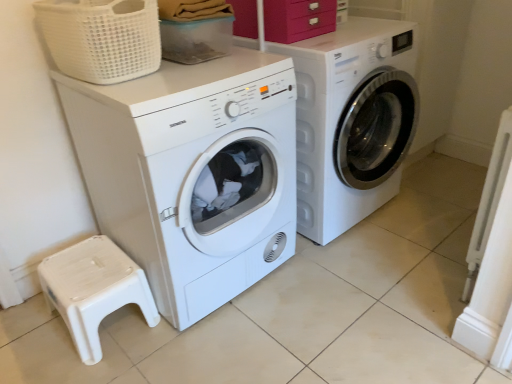
The image size is (512, 384). What do you see at coordinates (101, 38) in the screenshot? I see `white woven basket at upper left` at bounding box center [101, 38].

The height and width of the screenshot is (384, 512). Find the location of `white plastic step stool at lower left`. white plastic step stool at lower left is located at coordinates (93, 290).

Where is `white woven basket at upper left`? The height and width of the screenshot is (384, 512). white woven basket at upper left is located at coordinates (101, 38).

Would you say translucent plastic container at upper center is a long distance from white plastic step stool at lower left?

No, translucent plastic container at upper center is in close proximity to white plastic step stool at lower left.

Considering the relative sizes of translucent plastic container at upper center and white plastic step stool at lower left in the image provided, is translucent plastic container at upper center smaller than white plastic step stool at lower left?

Yes.

Considering the sizes of translucent plastic container at upper center and white plastic step stool at lower left in the image, is translucent plastic container at upper center wider or thinner than white plastic step stool at lower left?

In the image, translucent plastic container at upper center appears to be more narrow than white plastic step stool at lower left.

Visually, is white woven basket at upper left positioned to the left or to the right of white glossy washing machine at center, the first washing machine positioned from the right?

white woven basket at upper left is positioned on white glossy washing machine at center, the first washing machine positioned from the right,'s left side.

From the image's perspective, is white woven basket at upper left under white glossy washing machine at center, marked as the 2th washing machine in a left-to-right arrangement?

No, from the image's perspective, white woven basket at upper left is not below white glossy washing machine at center, marked as the 2th washing machine in a left-to-right arrangement.

What's the angular difference between white woven basket at upper left and white glossy washing machine at center, marked as the 2th washing machine in a left-to-right arrangement,'s facing directions?

2.08 degrees.

In the scene shown: From a real-world perspective, is white woven basket at upper left physically located above or below white glossy washing machine at center, the first washing machine positioned from the right?

white woven basket at upper left is situated higher than white glossy washing machine at center, the first washing machine positioned from the right, in the real world.

From the image's perspective, is matte pink drawer at upper center located beneath white plastic step stool at lower left?

No, from the image's perspective, matte pink drawer at upper center is not beneath white plastic step stool at lower left.

Considering the positions of objects matte pink drawer at upper center and white plastic step stool at lower left in the image provided, who is more to the left, matte pink drawer at upper center or white plastic step stool at lower left?

white plastic step stool at lower left.

Considering the positions of point (274, 18) and point (72, 298), is point (274, 18) closer or farther from the camera than point (72, 298)?

Point (274, 18) appears to be farther away from the viewer than point (72, 298).

Is white glossy washing machine at center, marked as the 2th washing machine in a left-to-right arrangement, closer to camera compared to translucent plastic container at upper center?

No.

Does white glossy washing machine at center, marked as the 2th washing machine in a left-to-right arrangement, have a greater width compared to translucent plastic container at upper center?

Correct, the width of white glossy washing machine at center, marked as the 2th washing machine in a left-to-right arrangement, exceeds that of translucent plastic container at upper center.

Which is correct: white glossy washing machine at center, the first washing machine positioned from the right, is inside translucent plastic container at upper center, or outside of it?

white glossy washing machine at center, the first washing machine positioned from the right, lies outside translucent plastic container at upper center.

From a real-world perspective, between white glossy washing machine at center, marked as the 2th washing machine in a left-to-right arrangement, and translucent plastic container at upper center, who is vertically lower?

white glossy washing machine at center, marked as the 2th washing machine in a left-to-right arrangement, from a real-world perspective.

How distant is translucent plastic container at upper center from white woven basket at upper left?

They are 20.78 inches apart.

Considering the relative positions of translucent plastic container at upper center and white woven basket at upper left in the image provided, is translucent plastic container at upper center to the left of white woven basket at upper left from the viewer's perspective?

No.

From the image's perspective, is translucent plastic container at upper center above or below white woven basket at upper left?

Clearly, from the image's perspective, translucent plastic container at upper center is above white woven basket at upper left.

Is translucent plastic container at upper center facing away from white woven basket at upper left?

translucent plastic container at upper center does not have its back to white woven basket at upper left.

Between white woven basket at upper left and white plastic step stool at lower left, which one has smaller width?

white plastic step stool at lower left is thinner.

Who is taller, white woven basket at upper left or white plastic step stool at lower left?

white plastic step stool at lower left.

From a real-world perspective, is white woven basket at upper left positioned above or below white plastic step stool at lower left?

From a real-world perspective, white woven basket at upper left is physically above white plastic step stool at lower left.

From the image's perspective, which is above, white woven basket at upper left or white plastic step stool at lower left?

white woven basket at upper left.

Is matte pink drawer at upper center positioned beyond the bounds of white matte washing machine at left, which ranks as the first washing machine in left-to-right order?

Yes, matte pink drawer at upper center is outside of white matte washing machine at left, which ranks as the first washing machine in left-to-right order.

Looking at this image, from a real-world perspective, is matte pink drawer at upper center under white matte washing machine at left, which ranks as the first washing machine in left-to-right order?

Incorrect, from a real-world perspective, matte pink drawer at upper center is higher than white matte washing machine at left, which ranks as the first washing machine in left-to-right order.

Locate an element on the screen. washing machine on the left of the matte pink drawer at upper center is located at coordinates (191, 173).

Does matte pink drawer at upper center turn towards white matte washing machine at left, the 2th washing machine positioned from the right?

No, matte pink drawer at upper center is not turned towards white matte washing machine at left, the 2th washing machine positioned from the right.

The height and width of the screenshot is (384, 512). What are the coordinates of `step stool below the translucent plastic container at upper center (from the image's perspective)` in the screenshot? It's located at (93, 290).

What are the coordinates of `basket located in front of the white glossy washing machine at center, marked as the 2th washing machine in a left-to-right arrangement` in the screenshot? It's located at (101, 38).

Looking at this image, when comparing their distances from matte pink drawer at upper center, does white woven basket at upper left or white glossy washing machine at center, the first washing machine positioned from the right, seem closer?

Among the two, white glossy washing machine at center, the first washing machine positioned from the right, is located nearer to matte pink drawer at upper center.

When comparing their distances from white woven basket at upper left, does translucent plastic container at upper center or white glossy washing machine at center, the first washing machine positioned from the right, seem closer?

translucent plastic container at upper center lies closer to white woven basket at upper left than the other object.

From the picture: Which object lies nearer to the anchor point white matte washing machine at left, the 2th washing machine positioned from the right, white glossy washing machine at center, marked as the 2th washing machine in a left-to-right arrangement, or white plastic step stool at lower left?

white plastic step stool at lower left.

From the image, which object appears to be farther from matte pink drawer at upper center, translucent plastic container at upper center or white woven basket at upper left?

The object further to matte pink drawer at upper center is white woven basket at upper left.

Which object lies nearer to the anchor point white matte washing machine at left, the 2th washing machine positioned from the right, translucent plastic container at upper center or white glossy washing machine at center, the first washing machine positioned from the right?

white glossy washing machine at center, the first washing machine positioned from the right.

Estimate the real-world distances between objects in this image. Which object is further from translucent plastic container at upper center, white woven basket at upper left or white matte washing machine at left, which ranks as the first washing machine in left-to-right order?

white matte washing machine at left, which ranks as the first washing machine in left-to-right order, is positioned further to the anchor translucent plastic container at upper center.

When comparing their distances from translucent plastic container at upper center, does white glossy washing machine at center, marked as the 2th washing machine in a left-to-right arrangement, or white woven basket at upper left seem closer?

white woven basket at upper left is closer to translucent plastic container at upper center.

Based on the photo, looking at the image, which one is located further to white matte washing machine at left, the 2th washing machine positioned from the right, white plastic step stool at lower left or white woven basket at upper left?

white plastic step stool at lower left lies further to white matte washing machine at left, the 2th washing machine positioned from the right, than the other object.

Identify the location of storage box between matte pink drawer at upper center and white plastic step stool at lower left from top to bottom. (196, 40).

This screenshot has width=512, height=384. What are the coordinates of `storage box situated between white woven basket at upper left and white glossy washing machine at center, marked as the 2th washing machine in a left-to-right arrangement, from left to right` in the screenshot? It's located at (196, 40).

Identify the location of washing machine between matte pink drawer at upper center and white matte washing machine at left, which ranks as the first washing machine in left-to-right order, from top to bottom. Image resolution: width=512 pixels, height=384 pixels. (351, 121).

At what (x,y) coordinates should I click in order to perform the action: click on basket between translucent plastic container at upper center and white matte washing machine at left, which ranks as the first washing machine in left-to-right order, in the vertical direction. Please return your answer as a coordinate pair (x, y). This screenshot has width=512, height=384. Looking at the image, I should click on (101, 38).